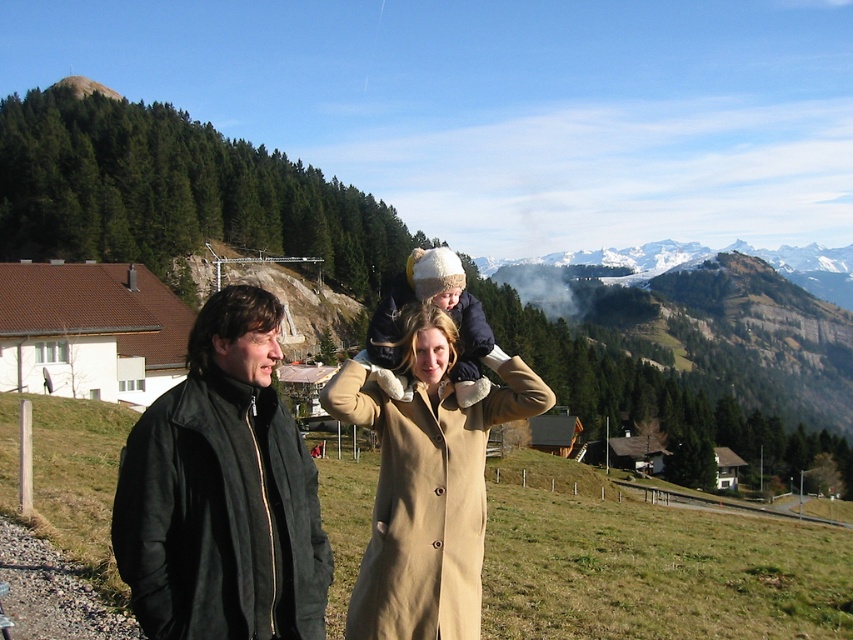
Does point (149, 556) come behind point (425, 371)?

No, (149, 556) is closer to viewer.

Where is `black leather jacket at left`? The width and height of the screenshot is (853, 640). black leather jacket at left is located at coordinates (222, 492).

Is black leather jacket at left taller than white knit hat at center?

Indeed, black leather jacket at left has a greater height compared to white knit hat at center.

The width and height of the screenshot is (853, 640). What do you see at coordinates (222, 492) in the screenshot? I see `black leather jacket at left` at bounding box center [222, 492].

Who is more forward, (219,566) or (395,282)?

Point (219,566) is more forward.

I want to click on black leather jacket at left, so click(x=222, y=492).

The width and height of the screenshot is (853, 640). What do you see at coordinates (426, 481) in the screenshot?
I see `beige woolen coat at center` at bounding box center [426, 481].

Is beige woolen coat at center to the left of white knit hat at center from the viewer's perspective?

Correct, you'll find beige woolen coat at center to the left of white knit hat at center.

Find the location of a particular element. beige woolen coat at center is located at coordinates (426, 481).

Locate an element on the screen. The width and height of the screenshot is (853, 640). beige woolen coat at center is located at coordinates (426, 481).